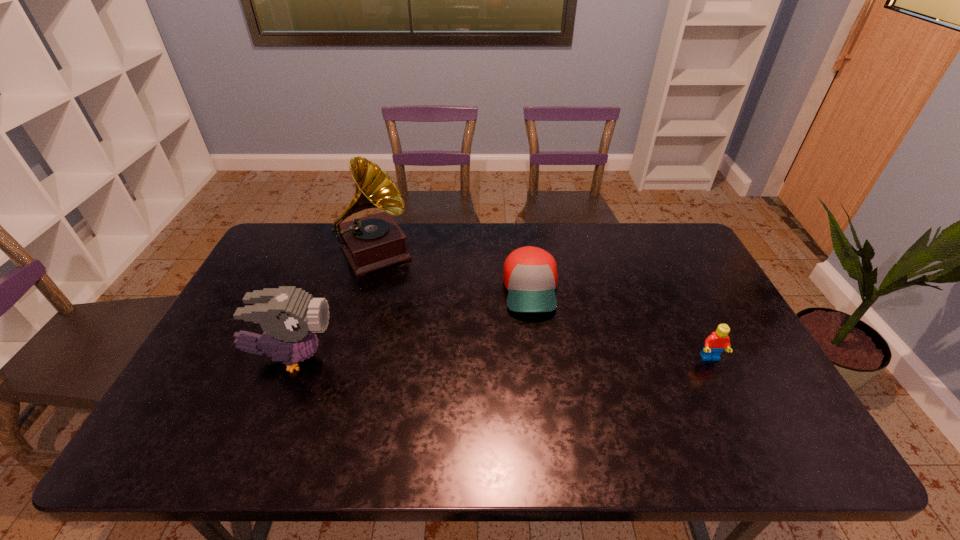
Where is `vacant space at the far left corner`? Image resolution: width=960 pixels, height=540 pixels. vacant space at the far left corner is located at coordinates (286, 242).

Image resolution: width=960 pixels, height=540 pixels. In the image, there is a desktop. Identify the location of free space at the far right corner. (650, 253).

This screenshot has width=960, height=540. What are the coordinates of `vacant space at the near right corner of the desktop` in the screenshot? It's located at (728, 403).

Where is `vacant space that's between the Lego and the second tallest object`? vacant space that's between the Lego and the second tallest object is located at coordinates (501, 359).

The height and width of the screenshot is (540, 960). I want to click on free space between the bird and the rightmost object, so click(501, 359).

The height and width of the screenshot is (540, 960). In order to click on vacant area between the phonograph record and the bird in this screenshot , I will do `click(334, 306)`.

Where is `free space between the phonograph record and the baseball cap`? This screenshot has height=540, width=960. free space between the phonograph record and the baseball cap is located at coordinates (453, 271).

The height and width of the screenshot is (540, 960). Find the location of `unoccupied area between the third object from left to right and the Lego`. unoccupied area between the third object from left to right and the Lego is located at coordinates (620, 324).

The image size is (960, 540). What are the coordinates of `empty space between the phonograph record and the bird` in the screenshot? It's located at (334, 306).

Where is `unoccupied area between the rightmost object and the baseball cap`? This screenshot has height=540, width=960. unoccupied area between the rightmost object and the baseball cap is located at coordinates (620, 324).